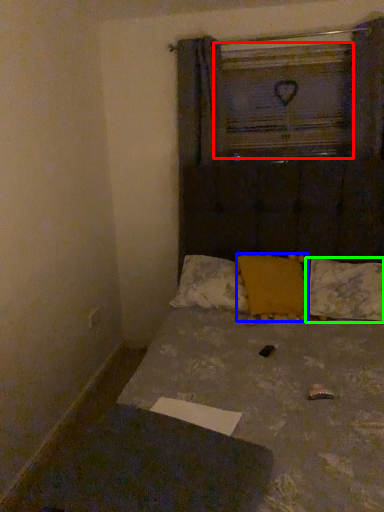
Question: Considering the real-world distances, which object is closest to window frame (highlighted by a red box)? pillow (highlighted by a blue box) or pillow (highlighted by a green box).

Choices:
 (A) pillow
 (B) pillow

Answer: (A)